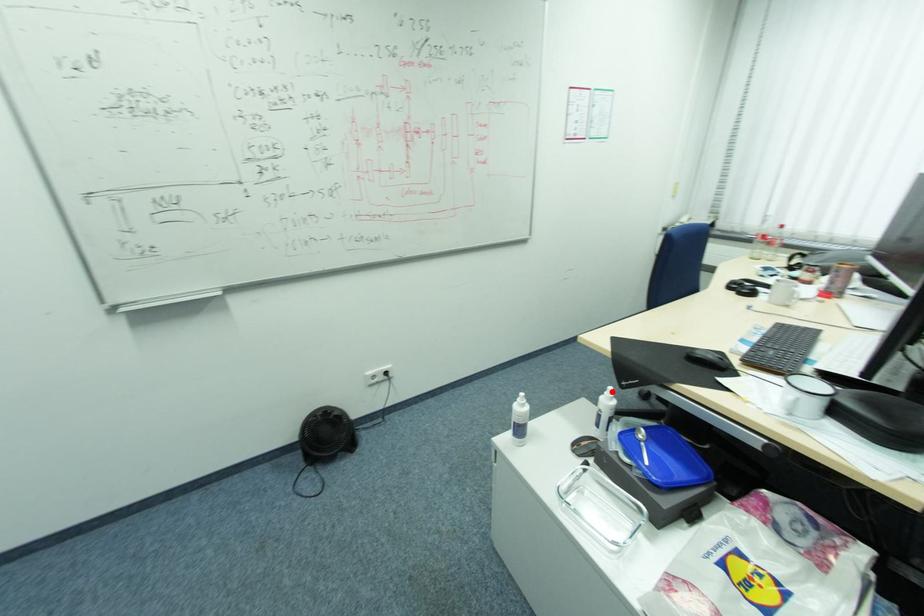
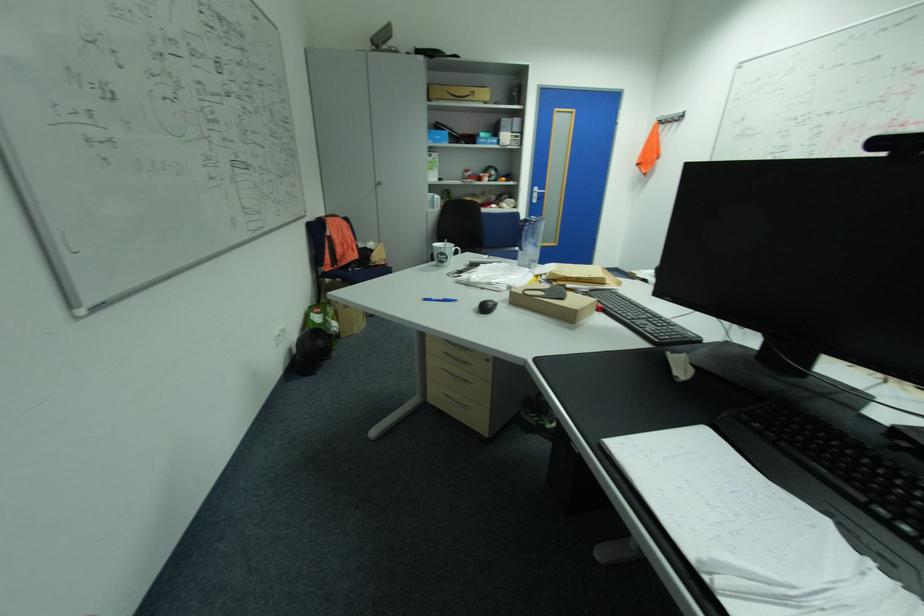
Question: I am providing you with two images of the same scene from different viewpoints. A red point is marked on the first image. Is the red point's position out of view in image 2?

Choices:
 (A) Yes
 (B) No

Answer: (A)